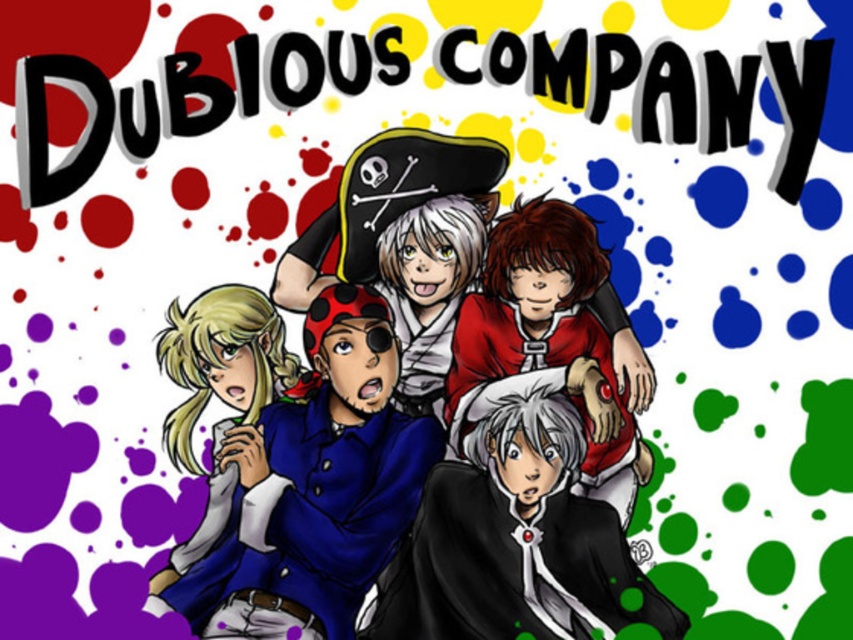
You are a photographer standing at the camera position. You want to capture a closeup shot of the smooth black coat at center. Given that your camera can focus on objects within 10 feet, will you be able to take the closeup without moving closer?

The smooth black coat at center is 10.65 feet away from the camera. Since the camera can only focus within 10 feet, you will need to move closer to take the closeup shot.

You are an artist trying to draw the scene described. You need to place a point at coordinates point (514, 541). Where should you place it?

The point (514, 541) should be placed on the smooth black coat at center.

Looking at the two central characters in the anime scene, which one is wearing an article of clothing that is larger in size between the blue fabric shirt at center and the smooth black coat at center?

The blue fabric shirt at center is bigger than the smooth black coat at center, so the article of clothing that is larger in size is the blue fabric shirt at center.